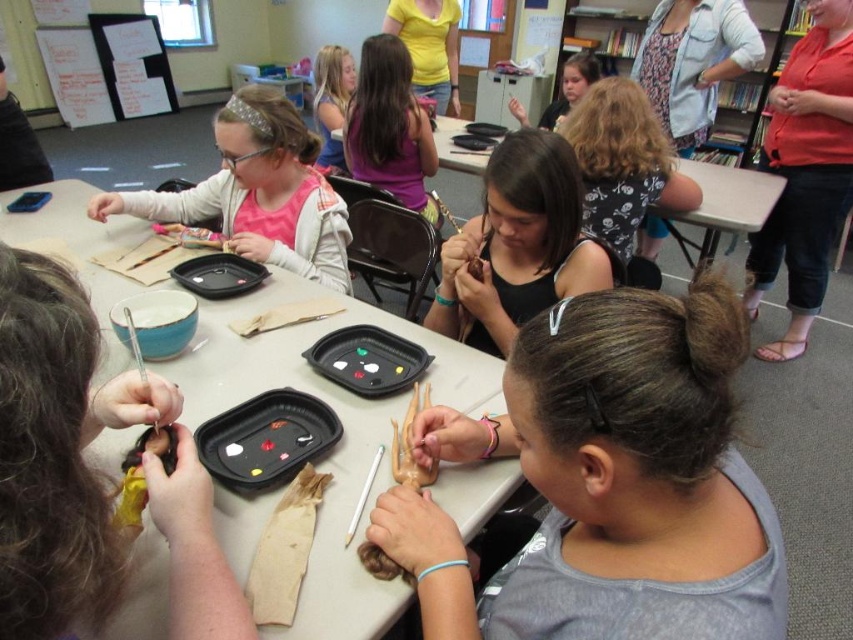
You are a teacher in the classroom and want to retrieve the matte pink shirt at left for a student. However, the matte brown doll at center is blocking your access. Can you move the doll to reach the shirt?

The matte brown doll at center is positioned under the matte pink shirt at left, meaning the doll is below the shirt. Since the shirt is above, you can reach the matte pink shirt at left without moving the doll.

You are a teacher in the classroom. You want to place a new craft kit exactly at the point marked by coordinates point (88, 474). Which object is located at that point?

The point (88, 474) corresponds to the matte black doll at lower left.

Looking at the craft table in the classroom, you see a matte brown doll at center and a matte pink shirt at left. Which object is positioned more to the right side of the table?

The matte brown doll at center is positioned more to the right side of the table compared to the matte pink shirt at left.